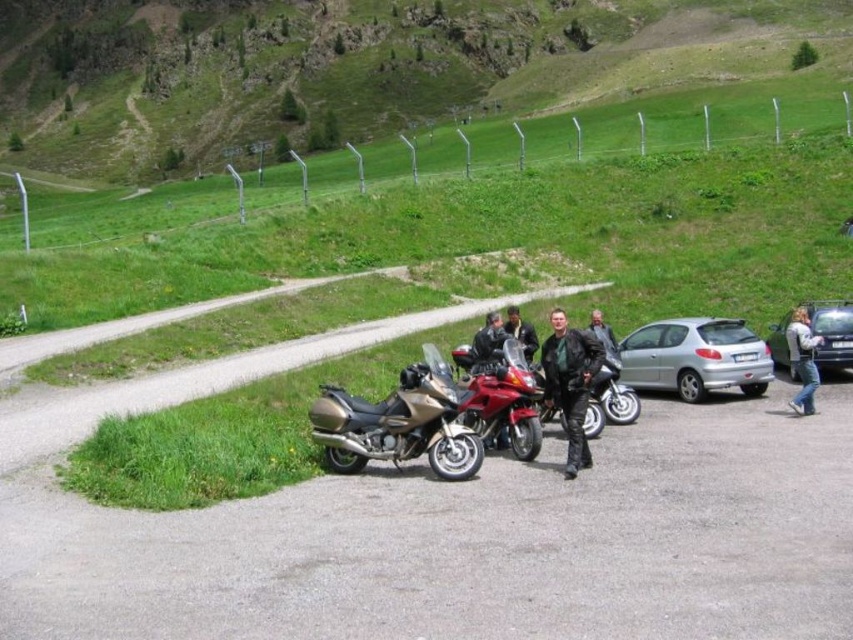
You are standing at the point marked by the coordinates point (210, 376). Looking around, you see a gravel road at center. What is directly under your feet?

The gravel road at center is located at point (210, 376), so the gravel road at center is directly under your feet.

You are standing at point (x=846, y=330) and want to walk to point (x=39, y=448). Which direction should you move relative to the mountain?

You should move forward towards the mountain because point (x=39, y=448) is in front of point (x=846, y=330) relative to the mountain.

You are standing at the point marked by the coordinates point (354, 67). Looking around, what do you see directly in front of you?

You see green grass at upper center directly in front of you at point (354, 67).